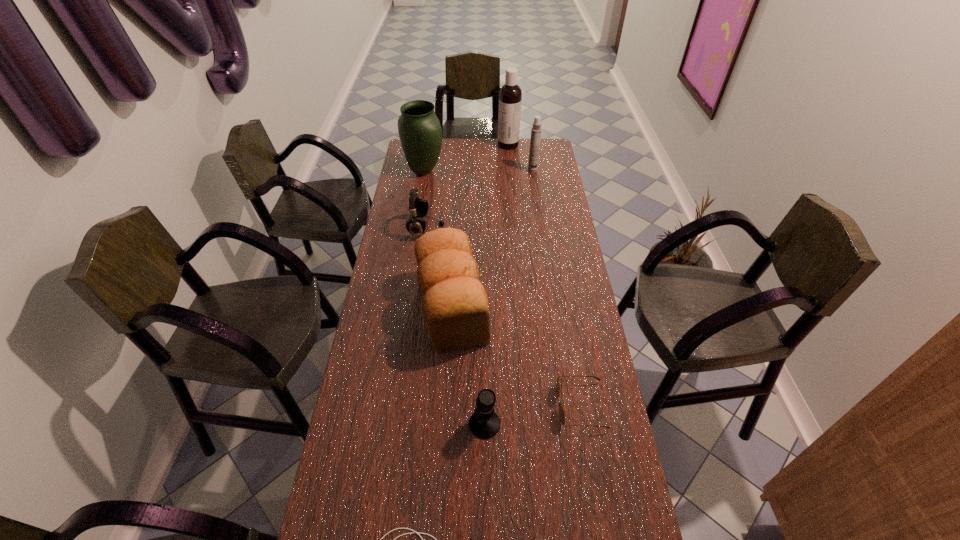
The height and width of the screenshot is (540, 960). Identify the location of dishwasher detergent. pyautogui.click(x=510, y=95).

Locate an element on the screen. the farthest object is located at coordinates (510, 95).

Where is `vase`? This screenshot has width=960, height=540. vase is located at coordinates (419, 129).

Identify the location of aerosol can. This screenshot has width=960, height=540. (536, 130).

I want to click on bread, so click(455, 304).

At what (x,y) coordinates should I click in order to perform the action: click on headset. Please return your answer as a coordinate pair (x, y). Looking at the image, I should click on 418,208.

Find the location of a particular element. This screenshot has height=540, width=960. microphone is located at coordinates (484, 423).

Image resolution: width=960 pixels, height=540 pixels. Find the location of `sunglasses`. sunglasses is located at coordinates (561, 410).

What are the coordinates of `vacant space located on the label side of the dishwasher detergent` in the screenshot? It's located at (427, 145).

Locate an element on the screen. This screenshot has height=540, width=960. blank area located on the label side of the dishwasher detergent is located at coordinates (479, 145).